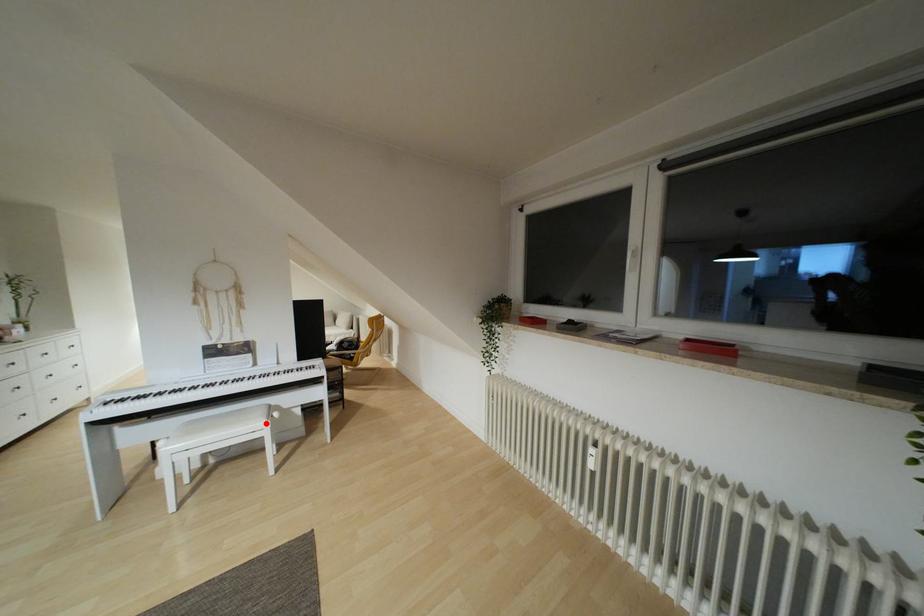
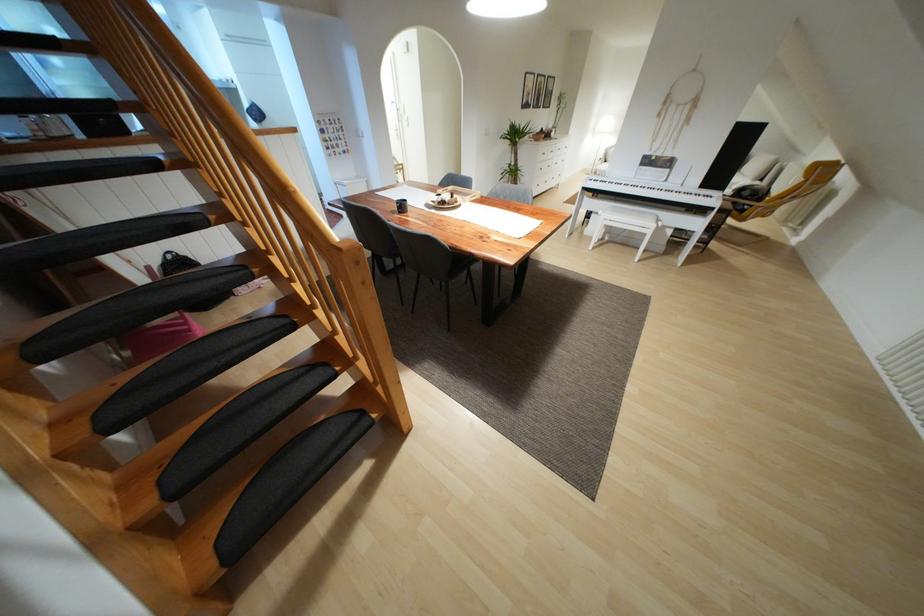
Question: I am providing you with two images of the same scene from different viewpoints. A red point is shown in image1. For the corresponding object point in image2, is it positioned nearer or farther from the camera?

Choices:
 (A) Nearer
 (B) Farther

Answer: (A)